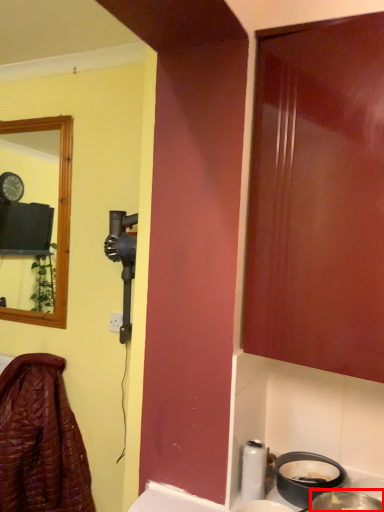
Question: In this image, where is basin (annotated by the red box) located relative to laundry?

Choices:
 (A) right
 (B) left

Answer: (A)